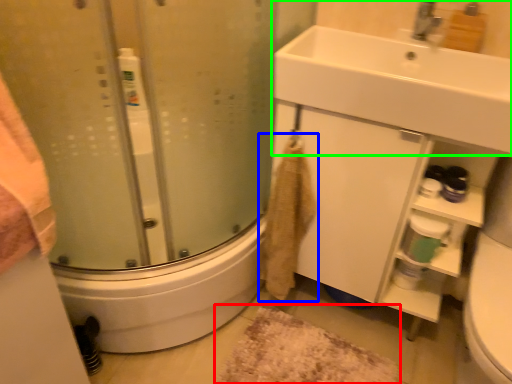
Question: Which is nearer to the bath mat (highlighted by a red box)? bath towel (highlighted by a blue box) or sink (highlighted by a green box).

Choices:
 (A) bath towel
 (B) sink

Answer: (A)